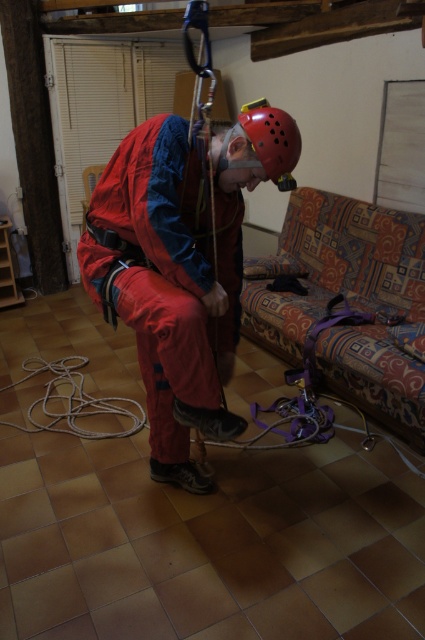
Between point (107, 164) and point (275, 170), which one is positioned in front?

Point (275, 170) is more forward.

Which of these two, matte red jumpsuit at center or red matte helmet at center, stands shorter?

With less height is red matte helmet at center.

Who is more distant from viewer, (x=269, y=156) or (x=294, y=122)?

The point (x=294, y=122) is more distant.

The image size is (425, 640). Identify the location of matte red jumpsuit at center. pos(181,268).

Is patterned fabric couch at lower right positioned in front of red matte helmet at center?

No, patterned fabric couch at lower right is behind red matte helmet at center.

Is patterned fabric couch at lower right above red matte helmet at center?

Incorrect, patterned fabric couch at lower right is not positioned above red matte helmet at center.

Who is more distant from viewer, (336, 365) or (252, 124)?

The point (336, 365) is behind.

The width and height of the screenshot is (425, 640). What are the coordinates of `patterned fabric couch at lower right` in the screenshot? It's located at (334, 268).

The height and width of the screenshot is (640, 425). I want to click on matte red jumpsuit at center, so click(x=181, y=268).

Does matte red jumpsuit at center appear on the left side of patterned fabric couch at lower right?

Indeed, matte red jumpsuit at center is positioned on the left side of patterned fabric couch at lower right.

The height and width of the screenshot is (640, 425). Describe the element at coordinates (181, 268) in the screenshot. I see `matte red jumpsuit at center` at that location.

Where is `matte red jumpsuit at center`? matte red jumpsuit at center is located at coordinates [x=181, y=268].